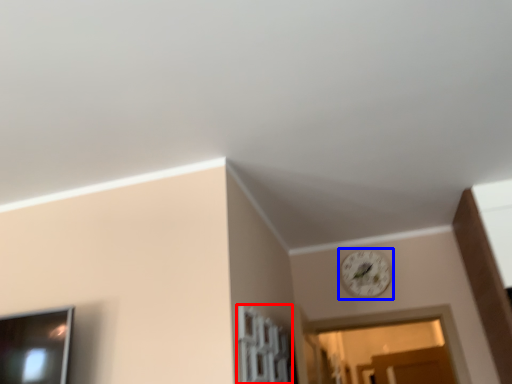
Question: Which object appears farthest to the camera in this image, window (highlighted by a red box) or clock (highlighted by a blue box)?

Choices:
 (A) window
 (B) clock

Answer: (B)